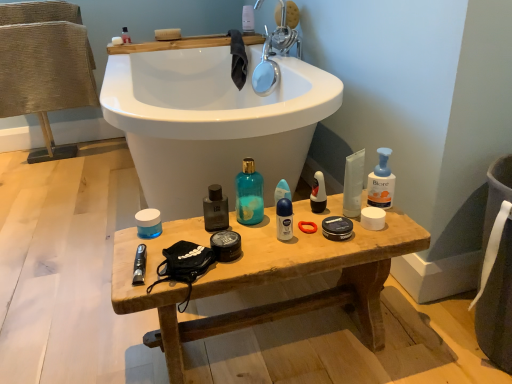
Question: Does matte plastic toothbrush at upper center, marked as the 4th toiletry in a left-to-right arrangement, have a greater height compared to blue matte deodorant stick at center, which ranks as the 4th toiletry in bottom-to-top order?

Choices:
 (A) yes
 (B) no

Answer: (A)

Question: Does matte plastic toothbrush at upper center, positioned as the 4th toiletry in right-to-left order, appear on the right side of blue matte deodorant stick at center, which ranks as the 4th toiletry in bottom-to-top order?

Choices:
 (A) no
 (B) yes

Answer: (A)

Question: Is matte plastic toothbrush at upper center, marked as the 4th toiletry in a left-to-right arrangement, behind blue matte deodorant stick at center, arranged as the 6th toiletry when viewed from the left?

Choices:
 (A) no
 (B) yes

Answer: (B)

Question: Can you confirm if matte plastic toothbrush at upper center, the 7th toiletry viewed from the front, is positioned to the left of blue matte deodorant stick at center, which ranks as the fifth toiletry in front-to-back order?

Choices:
 (A) yes
 (B) no

Answer: (A)

Question: Is matte plastic toothbrush at upper center, which appears as the 1th toiletry when viewed from the top, facing away from blue matte deodorant stick at center, which ranks as the 4th toiletry in bottom-to-top order?

Choices:
 (A) no
 (B) yes

Answer: (A)

Question: In terms of width, does white matte deodorant at center, which ranks as the sixth toiletry in top-to-bottom order, look wider or thinner when compared to matte black bottle at center, positioned as the 2th toiletry in front-to-back order?

Choices:
 (A) thin
 (B) wide

Answer: (A)

Question: Considering their positions, is white matte deodorant at center, acting as the seventh toiletry starting from the back, located in front of or behind matte black bottle at center, placed as the 5th toiletry when sorted from top to bottom?

Choices:
 (A) front
 (B) behind

Answer: (A)

Question: From the image's perspective, is white matte deodorant at center, the first toiletry viewed from the front, located above or below matte black bottle at center, placed as the 5th toiletry when sorted from right to left?

Choices:
 (A) below
 (B) above

Answer: (A)

Question: Is white matte deodorant at center, the third toiletry in the right-to-left sequence, inside the boundaries of matte black bottle at center, positioned as the 2th toiletry in front-to-back order, or outside?

Choices:
 (A) inside
 (B) outside

Answer: (B)

Question: Based on their sizes in the image, would you say blue pump bottle at right, which is the 3th cleaning product from left to right, is bigger or smaller than matte black deodorant at center, marked as the 5th toiletry in a bottom-to-top arrangement?

Choices:
 (A) big
 (B) small

Answer: (A)

Question: Do you think blue pump bottle at right, which is the first cleaning product in right-to-left order, is within matte black deodorant at center, marked as the 7th toiletry in a left-to-right arrangement, or outside of it?

Choices:
 (A) outside
 (B) inside

Answer: (A)

Question: Looking at their shapes, would you say blue pump bottle at right, which is the 3th cleaning product from left to right, is wider or thinner than matte black deodorant at center, which ranks as the third toiletry in top-to-bottom order?

Choices:
 (A) thin
 (B) wide

Answer: (A)

Question: Visually, is blue pump bottle at right, which is the 3th cleaning product from left to right, positioned to the left or to the right of matte black deodorant at center, which is the 4th toiletry from back to front?

Choices:
 (A) right
 (B) left

Answer: (A)

Question: Is matte plastic toothbrush at upper center, the 7th toiletry viewed from the front, inside the boundaries of matte black bottle at center, placed as the 5th toiletry when sorted from right to left, or outside?

Choices:
 (A) outside
 (B) inside

Answer: (A)

Question: From their relative heights in the image, would you say matte plastic toothbrush at upper center, marked as the 4th toiletry in a left-to-right arrangement, is taller or shorter than matte black bottle at center, the 3th toiletry from the left?

Choices:
 (A) short
 (B) tall

Answer: (B)